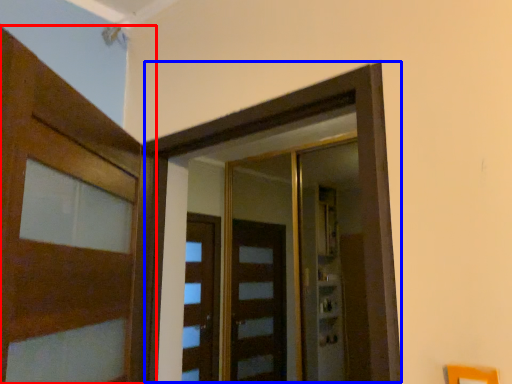
Question: Which point is further to the camera, door (highlighted by a red box) or elevator (highlighted by a blue box)?

Choices:
 (A) door
 (B) elevator

Answer: (B)